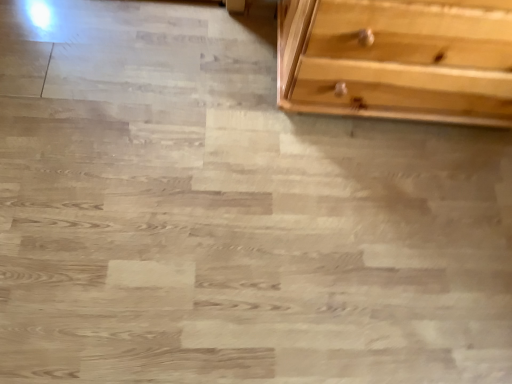
In order to click on unoccupied area in front of light wood chest of drawers at upper right in this screenshot , I will do `click(362, 226)`.